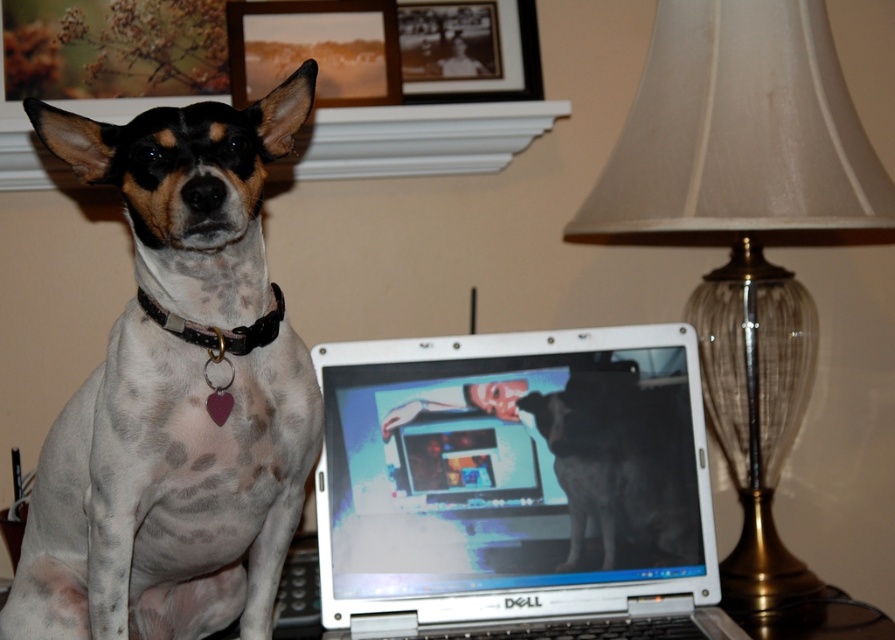
Question: Can you confirm if white plastic laptop at center is wider than wooden picture frame at upper center?

Choices:
 (A) no
 (B) yes

Answer: (B)

Question: Which of the following is the farthest from the observer?

Choices:
 (A) (186, 228)
 (B) (343, 96)
 (C) (772, 19)
 (D) (672, 531)

Answer: (B)

Question: Based on their relative distances, which object is farther from the speckled fur dog at left?

Choices:
 (A) black fur dog at center
 (B) black leather collar at upper left
 (C) translucent glass lampshade at upper center
 (D) black matte picture frame at upper center

Answer: (D)

Question: Observing the image, what is the correct spatial positioning of translucent glass lampshade at upper center in reference to black leather collar at upper left?

Choices:
 (A) left
 (B) right

Answer: (B)

Question: Is wooden picture frame at upper center closer to camera compared to black matte picture frame at upper center?

Choices:
 (A) yes
 (B) no

Answer: (A)

Question: Which object appears farthest from the camera in this image?

Choices:
 (A) black matte picture frame at upper center
 (B) black fur dog at center
 (C) wooden picture frame at upper center

Answer: (A)